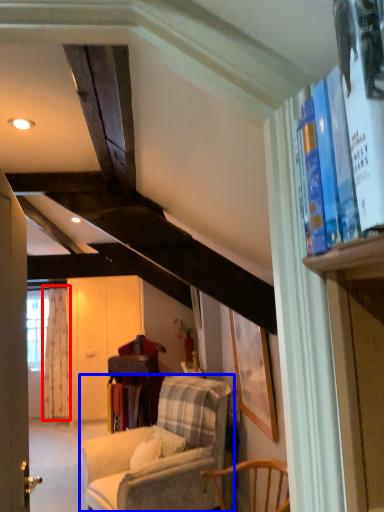
Question: Which of the following is the closest to the observer, curtain (highlighted by a red box) or chair (highlighted by a blue box)?

Choices:
 (A) curtain
 (B) chair

Answer: (B)